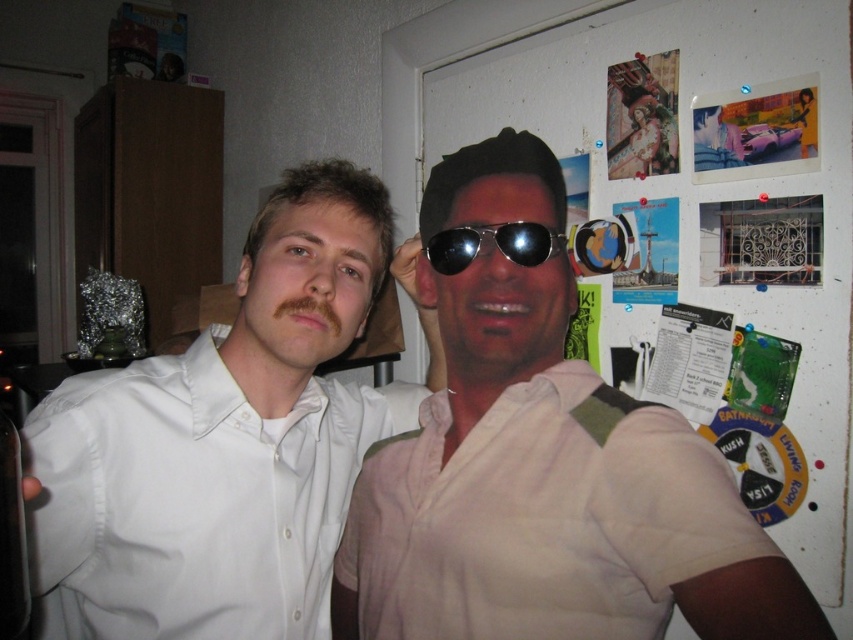
Does light beige shirt at center have a smaller size compared to metallic reflective sunglasses at center?

No.

Which is in front, point (508, 566) or point (444, 256)?

Point (508, 566) is more forward.

Find the location of a particular element. light beige shirt at center is located at coordinates (548, 497).

Is beige cotton shirt at center positioned before metallic reflective sunglasses at center?

Yes, it is.

Is beige cotton shirt at center further to camera compared to metallic reflective sunglasses at center?

That is False.

Does point (447, 481) come closer to viewer compared to point (503, 243)?

No, it is not.

You are a GUI agent. You are given a task and a screenshot of the screen. Output one action in this format:
    pyautogui.click(x=<x>, y=<y>)
    Task: Click on the beige cotton shirt at center
    This screenshot has width=853, height=640.
    Given the screenshot: What is the action you would take?
    pyautogui.click(x=540, y=518)

Between white smooth shirt at left and metallic reflective sunglasses at center, which one appears on the right side from the viewer's perspective?

From the viewer's perspective, metallic reflective sunglasses at center appears more on the right side.

Does white smooth shirt at left have a lesser height compared to metallic reflective sunglasses at center?

Incorrect, white smooth shirt at left's height does not fall short of metallic reflective sunglasses at center's.

Describe the element at coordinates (193, 499) in the screenshot. The image size is (853, 640). I see `white smooth shirt at left` at that location.

I want to click on white smooth shirt at left, so click(193, 499).